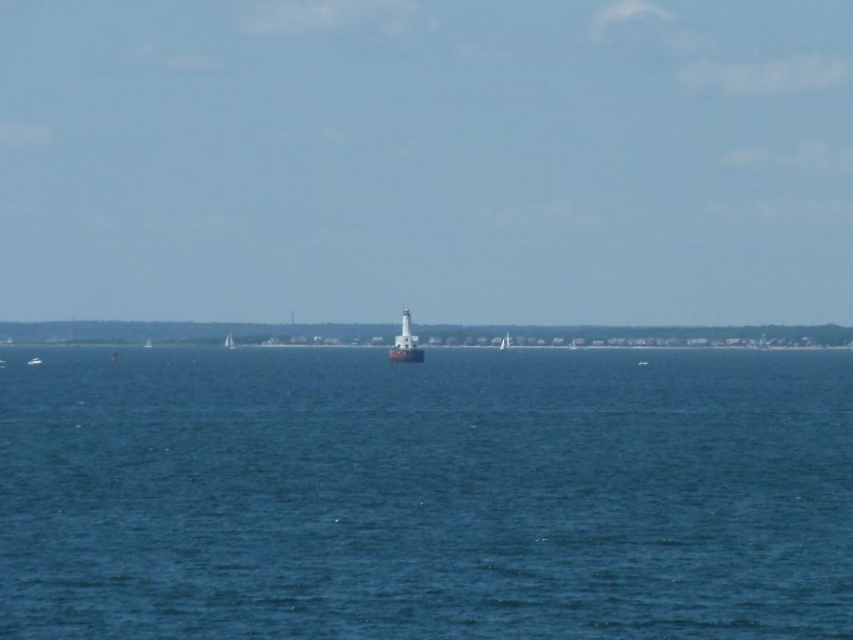
Is point (231, 344) more distant than point (151, 344)?

No.

This screenshot has height=640, width=853. Identify the location of white matte sailboat at center. (229, 340).

Between point (227, 348) and point (149, 346), which one is positioned behind?

The point (149, 346) is behind.

You are a GUI agent. You are given a task and a screenshot of the screen. Output one action in this format:
    pyautogui.click(x=<x>, y=<y>)
    Task: Click on the white matte sailboat at center
    Image resolution: width=853 pixels, height=640 pixels.
    Given the screenshot: What is the action you would take?
    pyautogui.click(x=229, y=340)

Does blue water at center appear on the right side of white matte lighthouse at center?

No, blue water at center is not to the right of white matte lighthouse at center.

Is point (848, 536) behind point (392, 353)?

No, (848, 536) is in front of (392, 353).

This screenshot has height=640, width=853. In order to click on blue water at center in this screenshot , I will do `click(424, 493)`.

Find the location of a particular element. blue water at center is located at coordinates (424, 493).

Between smooth sand at center and white sailboat at center, which one has more height?

Standing taller between the two is smooth sand at center.

Between point (20, 323) and point (506, 349), which one is positioned behind?

Point (20, 323)

The width and height of the screenshot is (853, 640). Find the location of `smooth sand at center`. smooth sand at center is located at coordinates (637, 333).